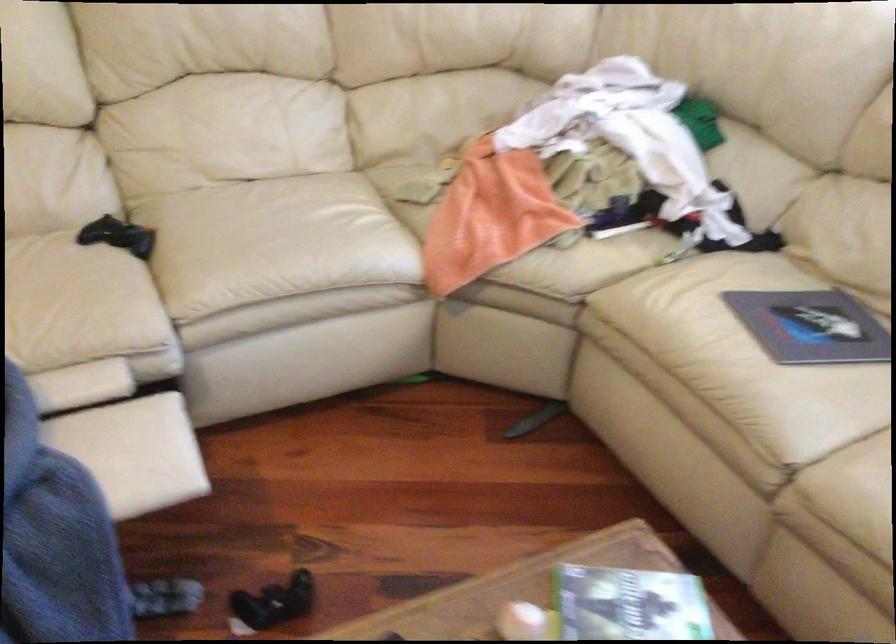
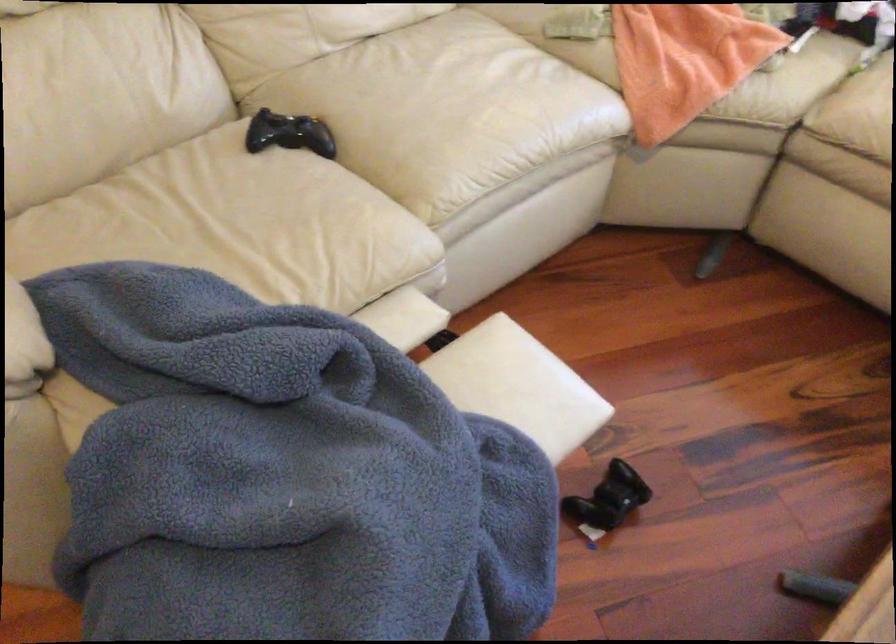
The point at (x=246, y=234) is marked in the first image. Where is the corresponding point in the second image?

(446, 109)